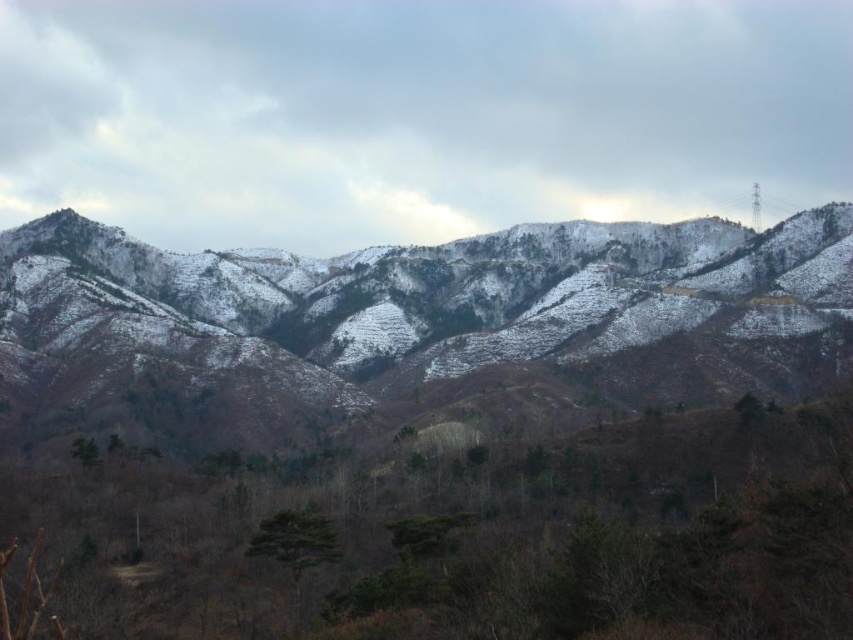
Is point (811, 481) farther from camera compared to point (82, 436)?

No, it is not.

Can you confirm if brown matte tree at lower center is positioned to the left of green matte tree at lower left?

Incorrect, brown matte tree at lower center is not on the left side of green matte tree at lower left.

Does point (619, 500) come behind point (93, 440)?

No, it is not.

The height and width of the screenshot is (640, 853). In order to click on brown matte tree at lower center in this screenshot , I will do `click(462, 541)`.

Who is more forward, (247,548) or (88,451)?

Point (247,548) is in front.

Is point (247, 556) positioned behind point (86, 452)?

No, it is in front of (86, 452).

Locate an element on the screen. green matte tree at center is located at coordinates (294, 547).

Image resolution: width=853 pixels, height=640 pixels. I want to click on green matte tree at center, so click(x=294, y=547).

Can you confirm if snowy brown mountains at center is wider than green matte tree at lower left?

Yes, snowy brown mountains at center is wider than green matte tree at lower left.

Consider the image. Between snowy brown mountains at center and green matte tree at lower left, which one appears on the left side from the viewer's perspective?

From the viewer's perspective, green matte tree at lower left appears more on the left side.

Which is in front, point (30, 227) or point (73, 456)?

Point (73, 456) is in front.

Identify the location of snowy brown mountains at center. (415, 323).